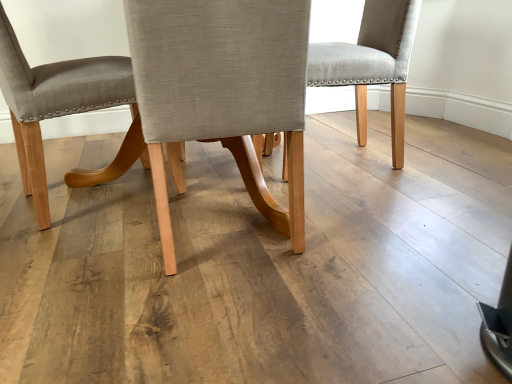
The height and width of the screenshot is (384, 512). In order to click on free space in front of matte gray fabric chair at center, which appears as the first chair when viewed from the left in this screenshot , I will do `click(81, 261)`.